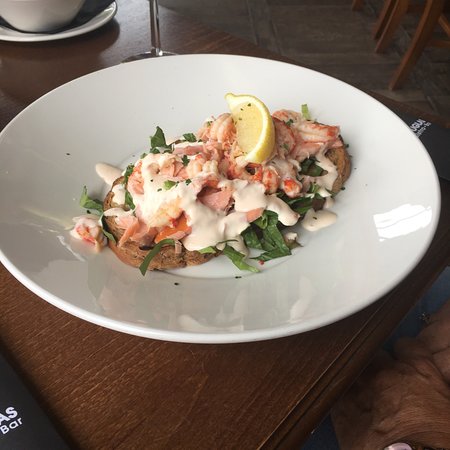
This screenshot has width=450, height=450. I want to click on bowl, so click(x=244, y=287).